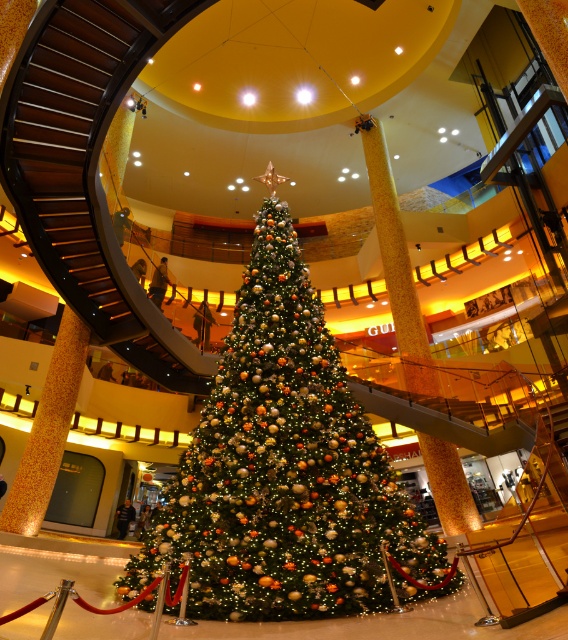
Question: Does shiny metallic christmas tree at center have a lesser width compared to brown wooden stairs at center?

Choices:
 (A) no
 (B) yes

Answer: (A)

Question: Which point appears closest to the camera in this image?

Choices:
 (A) (102, 12)
 (B) (241, 620)

Answer: (B)

Question: Observing the image, what is the correct spatial positioning of shiny metallic christmas tree at center in reference to brown wooden stairs at center?

Choices:
 (A) right
 (B) left

Answer: (A)

Question: Is shiny metallic christmas tree at center closer to camera compared to brown wooden stairs at center?

Choices:
 (A) yes
 (B) no

Answer: (A)